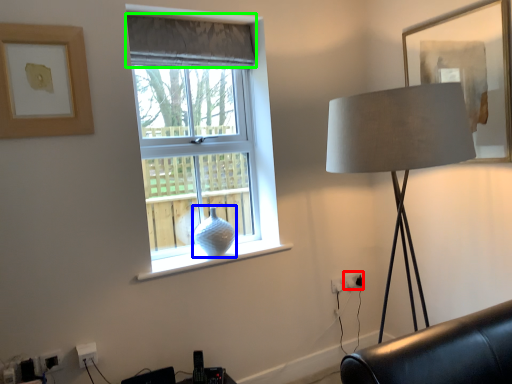
Question: Based on their relative distances, which object is farther from electric outlet (highlighted by a red box)? Choose from glass vase (highlighted by a blue box) and curtain (highlighted by a green box).

Choices:
 (A) glass vase
 (B) curtain

Answer: (B)